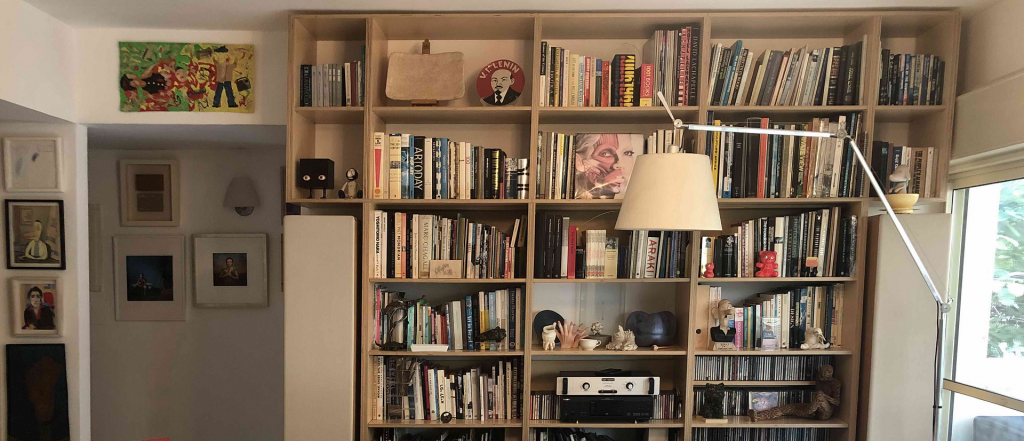
Locate an element on the screen. The height and width of the screenshot is (441, 1024). top window panel is located at coordinates [1001, 288].